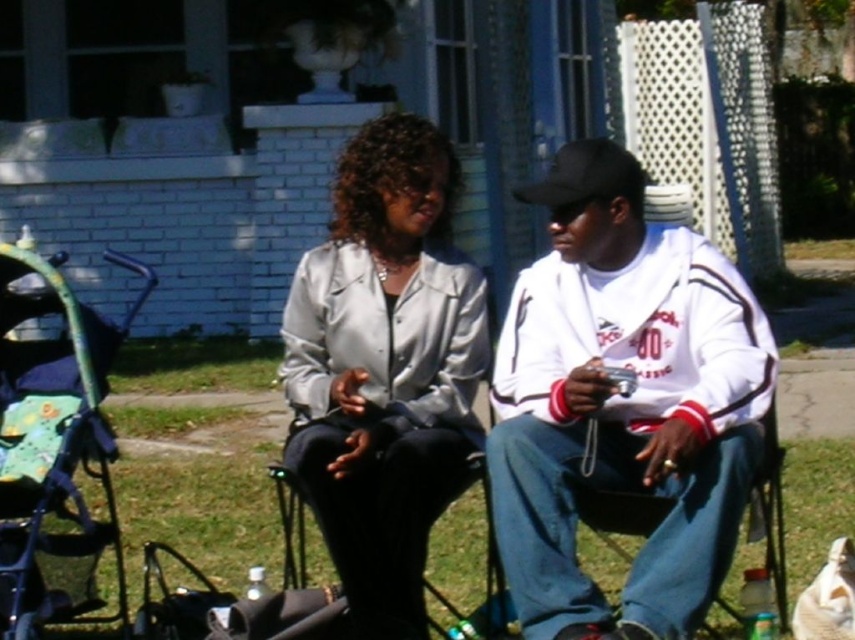
Can you confirm if white fleece jacket at center is positioned to the left of green plastic baby carriage at left?

Incorrect, white fleece jacket at center is not on the left side of green plastic baby carriage at left.

Does white fleece jacket at center appear over green plastic baby carriage at left?

Yes.

Find the location of a particular element. The height and width of the screenshot is (640, 855). white fleece jacket at center is located at coordinates (623, 403).

Does white fleece jacket at center come behind satin silver jacket at center?

No, it is in front of satin silver jacket at center.

Between white fleece jacket at center and satin silver jacket at center, which one is positioned higher?

satin silver jacket at center

In the scene shown: Measure the distance between white fleece jacket at center and camera.

4.89 meters

You are a GUI agent. You are given a task and a screenshot of the screen. Output one action in this format:
    pyautogui.click(x=<x>, y=<y>)
    Task: Click on the white fleece jacket at center
    The image size is (855, 640).
    Given the screenshot: What is the action you would take?
    pyautogui.click(x=623, y=403)

Is point (444, 449) farther from camera compared to point (86, 561)?

No, (444, 449) is closer to viewer.

Does satin silver jacket at center have a smaller size compared to green plastic baby carriage at left?

No.

Which is behind, point (475, 433) or point (60, 260)?

The point (475, 433) is more distant.

You are a GUI agent. You are given a task and a screenshot of the screen. Output one action in this format:
    pyautogui.click(x=<x>, y=<y>)
    Task: Click on the satin silver jacket at center
    Image resolution: width=855 pixels, height=640 pixels.
    Given the screenshot: What is the action you would take?
    pyautogui.click(x=385, y=368)